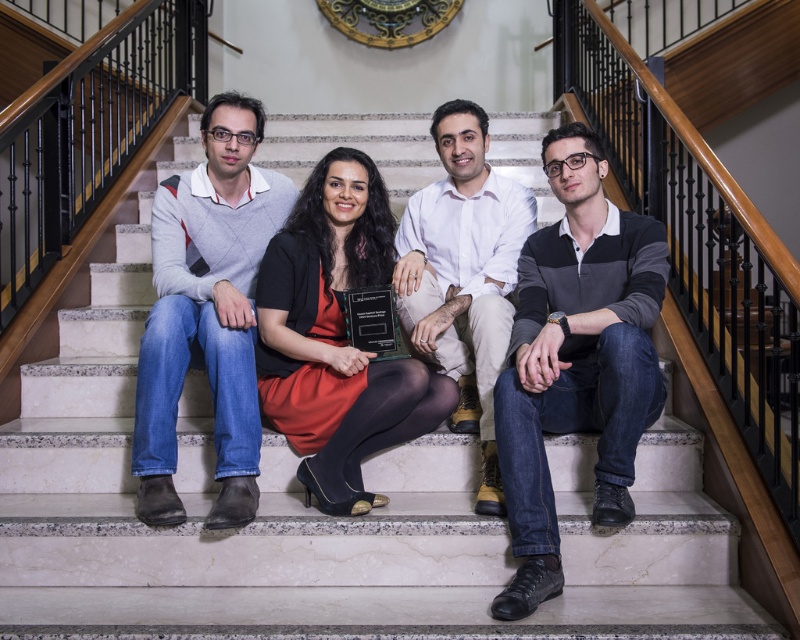
Can you confirm if dark gray knit sweater at center is bigger than matte black award at center?

Yes.

Does dark gray knit sweater at center have a greater height compared to matte black award at center?

Yes, dark gray knit sweater at center is taller than matte black award at center.

Who is more distant from viewer, (504, 458) or (374, 403)?

Positioned behind is point (374, 403).

Locate an element on the screen. The image size is (800, 640). dark gray knit sweater at center is located at coordinates (576, 358).

Based on the photo, who is higher up, matte gray sweater at left or white cotton shirt at center?

white cotton shirt at center

Between matte gray sweater at left and white cotton shirt at center, which one appears on the right side from the viewer's perspective?

white cotton shirt at center is more to the right.

Is point (236, 493) farther from camera compared to point (396, 284)?

No.

Where is `matte gray sweater at left`? The width and height of the screenshot is (800, 640). matte gray sweater at left is located at coordinates (208, 312).

Who is lower down, dark gray knit sweater at center or matte gray sweater at left?

dark gray knit sweater at center is below.

The height and width of the screenshot is (640, 800). What do you see at coordinates (576, 358) in the screenshot?
I see `dark gray knit sweater at center` at bounding box center [576, 358].

The height and width of the screenshot is (640, 800). What are the coordinates of `dark gray knit sweater at center` in the screenshot? It's located at (576, 358).